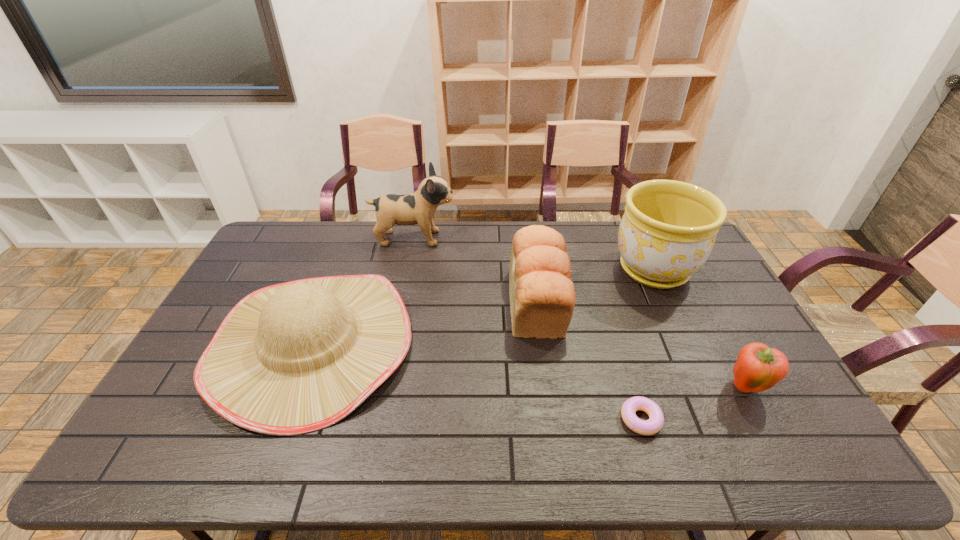
Locate an element on the screen. The width and height of the screenshot is (960, 540). object that is at the near left corner is located at coordinates (293, 358).

In order to click on object that is at the far right corner in this screenshot , I will do `click(668, 230)`.

In the image, there is a desktop. At what (x,y) coordinates should I click in order to perform the action: click on vacant space at the far edge. Please return your answer as a coordinate pair (x, y). The image size is (960, 540). Looking at the image, I should click on (348, 257).

Locate an element on the screen. The image size is (960, 540). free space at the near edge of the desktop is located at coordinates (248, 464).

Image resolution: width=960 pixels, height=540 pixels. Find the location of `vacant space at the left edge`. vacant space at the left edge is located at coordinates (191, 431).

Find the location of a particular element. The height and width of the screenshot is (540, 960). blank area at the near left corner is located at coordinates (164, 462).

Identify the location of vacant space that's between the third object from left to right and the sunhat. (424, 323).

Find the location of `free space between the bread and the pepper`. free space between the bread and the pepper is located at coordinates (641, 345).

Locate an element on the screen. The height and width of the screenshot is (540, 960). blank region between the shortest object and the pepper is located at coordinates (693, 403).

This screenshot has width=960, height=540. What are the coordinates of `free space between the puppy and the fourth object from right to left` in the screenshot? It's located at (475, 270).